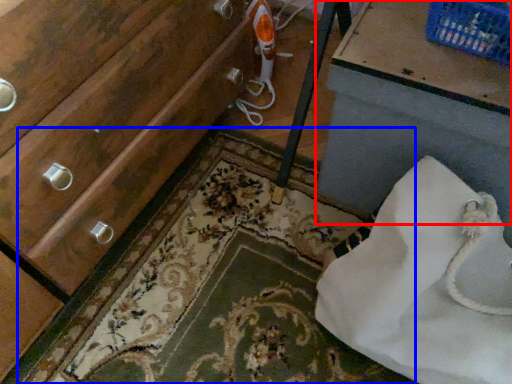
Question: Which point is further to the camera, vanity (highlighted by a red box) or bath mat (highlighted by a blue box)?

Choices:
 (A) vanity
 (B) bath mat

Answer: (B)